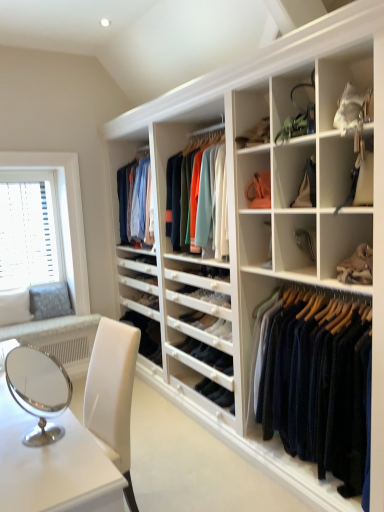
Question: In terms of size, does matte black purse at upper right, the 3th shelf positioned from the bottom, appear bigger or smaller than matte green handbag at upper right, the 1th shelf from the top?

Choices:
 (A) big
 (B) small

Answer: (A)

Question: In the image, is matte black purse at upper right, the 2th shelf when ordered from top to bottom, positioned in front of or behind matte green handbag at upper right, which appears as the 4th shelf when ordered from the bottom?

Choices:
 (A) behind
 (B) front

Answer: (B)

Question: Which object is positioned farthest from the navy wool sweater at center?

Choices:
 (A) matte black purse at upper right, the 3th shelf positioned from the bottom
 (B) white matte shelf at center, marked as the second shelf in a bottom-to-top arrangement
 (C) matte green handbag at upper right, the 1th shelf from the top
 (D) leather handbag at center right, which ranks as the fourth shelf in top-to-bottom order
 (E) white plastic blinds at left

Answer: (E)

Question: Estimate the real-world distances between objects in this image. Which object is closer to the matte green handbag at upper right, the 1th shelf from the top?

Choices:
 (A) matte black purse at upper right, the 3th shelf positioned from the bottom
 (B) navy wool sweater at center
 (C) white plastic blinds at left
 (D) white matte shelf at center, placed as the third shelf when sorted from top to bottom
 (E) leather handbag at center right, which ranks as the fourth shelf in top-to-bottom order

Answer: (A)